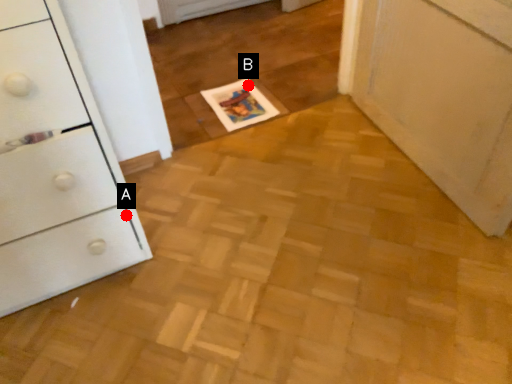
Question: Two points are circled on the image, labeled by A and B beside each circle. Among these points, which one is nearest to the camera?

Choices:
 (A) A is closer
 (B) B is closer

Answer: (A)